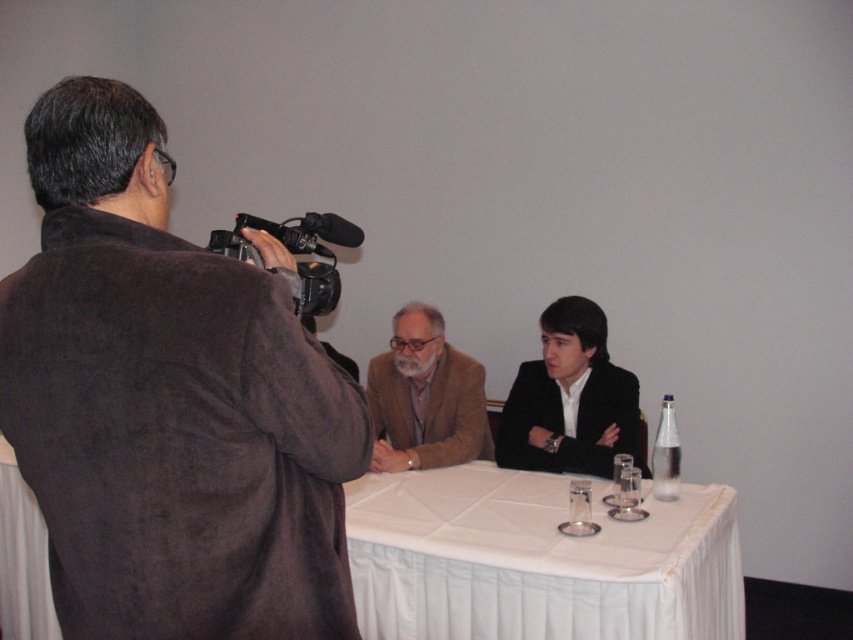
Does brown woolen suit at center have a greater width compared to black plastic video camera at upper left?

Yes, brown woolen suit at center is wider than black plastic video camera at upper left.

Find the location of a particular element. brown woolen suit at center is located at coordinates pyautogui.click(x=433, y=410).

Between point (297, 625) and point (318, 301), which one is positioned behind?

The point (318, 301) is more distant.

Is brown suede jacket at left bigger than black plastic video camera at upper left?

Yes, brown suede jacket at left is bigger than black plastic video camera at upper left.

Who is more forward, (x=91, y=164) or (x=318, y=230)?

Point (x=91, y=164) is in front.

Locate an element on the screen. This screenshot has height=640, width=853. brown suede jacket at left is located at coordinates (167, 401).

In the scene shown: Is brown suede jacket at left bigger than black matte business suit at center?

Correct, brown suede jacket at left is larger in size than black matte business suit at center.

Is brown suede jacket at left in front of black matte business suit at center?

Yes, it is in front of black matte business suit at center.

Where is `brown suede jacket at left`? This screenshot has width=853, height=640. brown suede jacket at left is located at coordinates (167, 401).

This screenshot has height=640, width=853. Find the location of `brown suede jacket at left`. brown suede jacket at left is located at coordinates pyautogui.click(x=167, y=401).